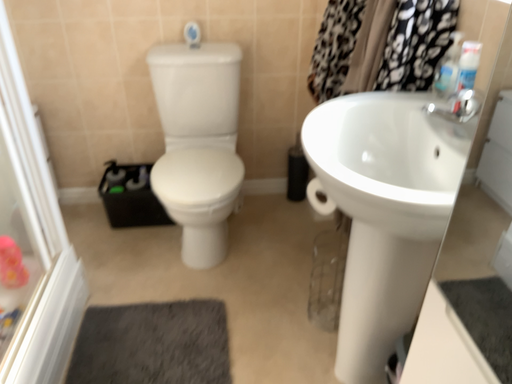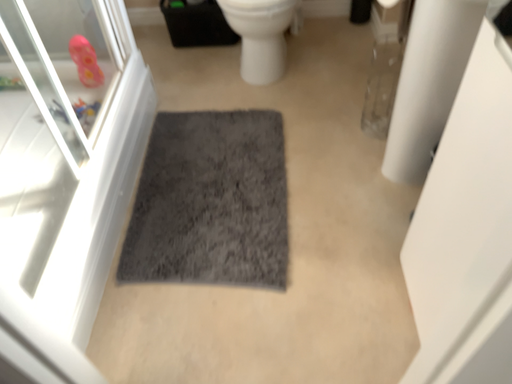
Question: Which way did the camera rotate in the video?

Choices:
 (A) rotated downward
 (B) rotated upward

Answer: (A)